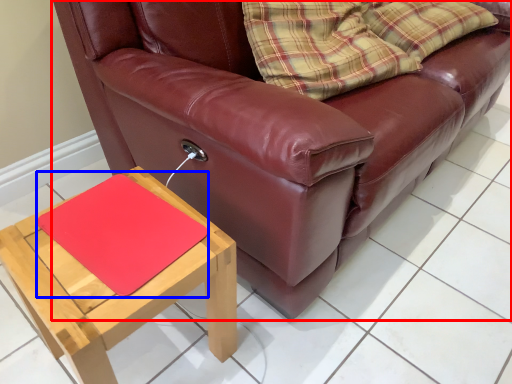
Question: Which object is closer to the camera taking this photo, studio couch (highlighted by a red box) or mat (highlighted by a blue box)?

Choices:
 (A) studio couch
 (B) mat

Answer: (A)